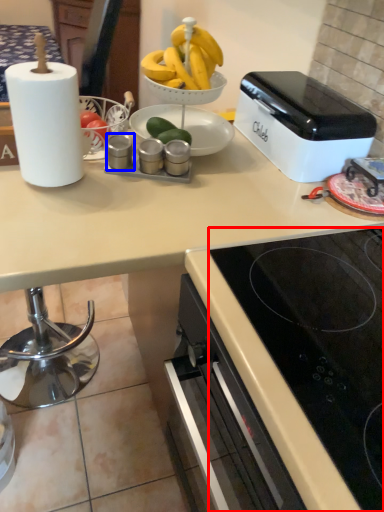
Question: Which point is further to the camera, gas stove (highlighted by a red box) or appliance (highlighted by a blue box)?

Choices:
 (A) gas stove
 (B) appliance

Answer: (B)